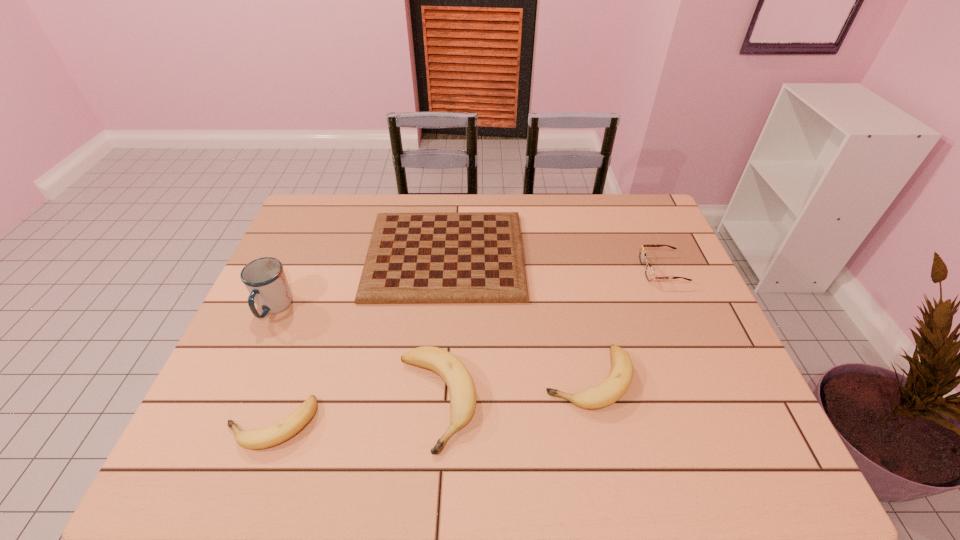
Where is `free space between the rightmost object and the shortest object`? This screenshot has width=960, height=540. free space between the rightmost object and the shortest object is located at coordinates (554, 263).

I want to click on free space between the second banana from left to right and the leftmost banana, so click(x=354, y=413).

What are the coordinates of `blank region between the leftmost banana and the second banana from right to left` in the screenshot? It's located at (354, 413).

Locate an element on the screen. The width and height of the screenshot is (960, 540). free space that is in between the shortest object and the shortest banana is located at coordinates (358, 340).

The image size is (960, 540). In order to click on object identified as the third closest to the gameboard in this screenshot , I will do `click(461, 386)`.

Identify the location of object that ranks as the third closest to the spectacles. This screenshot has width=960, height=540. (461, 386).

Point out which banana is positioned as the nearest to the leftmost banana. Please provide its 2D coordinates. Your answer should be formatted as a tuple, i.e. [(x, y)], where the tuple contains the x and y coordinates of a point satisfying the conditions above.

[(461, 386)]

Find the location of a particular element. banana that is the second closest one to the second tallest banana is located at coordinates (254, 439).

I want to click on vacant space that satisfies the following two spatial constraints: 1. on the frame of the spectacles; 2. on the handle side of the mug, so [x=679, y=308].

Where is `vacant area in the image that satisfies the following two spatial constraints: 1. on the frame of the rightmost object; 2. on the handle side of the tallest object`? vacant area in the image that satisfies the following two spatial constraints: 1. on the frame of the rightmost object; 2. on the handle side of the tallest object is located at coordinates tap(679, 308).